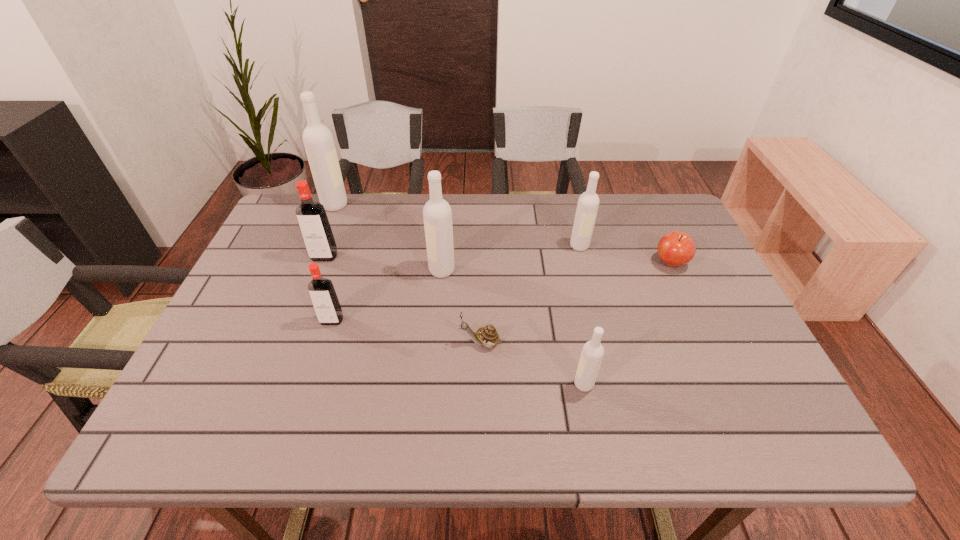
Locate an element on the screen. The width and height of the screenshot is (960, 540). the tallest object is located at coordinates (318, 140).

Where is `the farthest white vodka`? Image resolution: width=960 pixels, height=540 pixels. the farthest white vodka is located at coordinates (318, 140).

Find the location of a particular element. the third farthest white vodka is located at coordinates (437, 215).

Locate an element on the screen. the seventh shortest object is located at coordinates (437, 215).

The image size is (960, 540). Find the location of `the rightmost white vodka`. the rightmost white vodka is located at coordinates (588, 202).

The image size is (960, 540). Identify the location of the third biggest white vodka. (588, 202).

What are the coordinates of `the left red vodka` in the screenshot? It's located at (314, 225).

This screenshot has height=540, width=960. I want to click on the farther red vodka, so click(314, 225).

Find the location of a particular element. the third white vodka from left to right is located at coordinates (592, 353).

The image size is (960, 540). I want to click on the third object from right to left, so click(x=592, y=353).